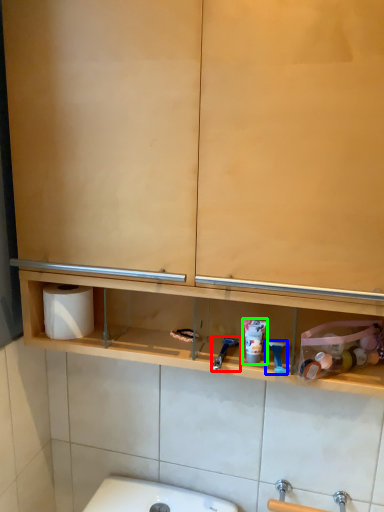
Question: Considering the real-world distances, which object is closest to shower (highlighted by a red box)? shower (highlighted by a blue box) or shaving cream (highlighted by a green box).

Choices:
 (A) shower
 (B) shaving cream

Answer: (B)